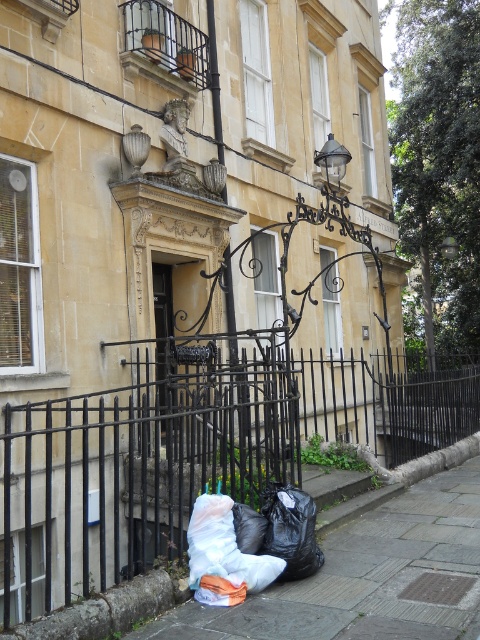
Question: Which object is positioned closest to the black metal fence at lower left?

Choices:
 (A) white plastic bag at lower center
 (B) black plastic bags at lower center

Answer: (A)

Question: Which point is farther to the camera?

Choices:
 (A) (398, 422)
 (B) (286, 632)

Answer: (A)

Question: Estimate the real-world distances between objects in this image. Which object is closer to the black plastic bags at lower center?

Choices:
 (A) white plastic bag at lower center
 (B) black metal fence at lower left

Answer: (A)

Question: Does black metal fence at lower left have a larger size compared to white plastic bag at lower center?

Choices:
 (A) yes
 (B) no

Answer: (A)

Question: Does black plastic bags at lower center have a larger size compared to white plastic bag at lower center?

Choices:
 (A) no
 (B) yes

Answer: (B)

Question: Can you confirm if black metal fence at lower left is bigger than white plastic bag at lower center?

Choices:
 (A) yes
 (B) no

Answer: (A)